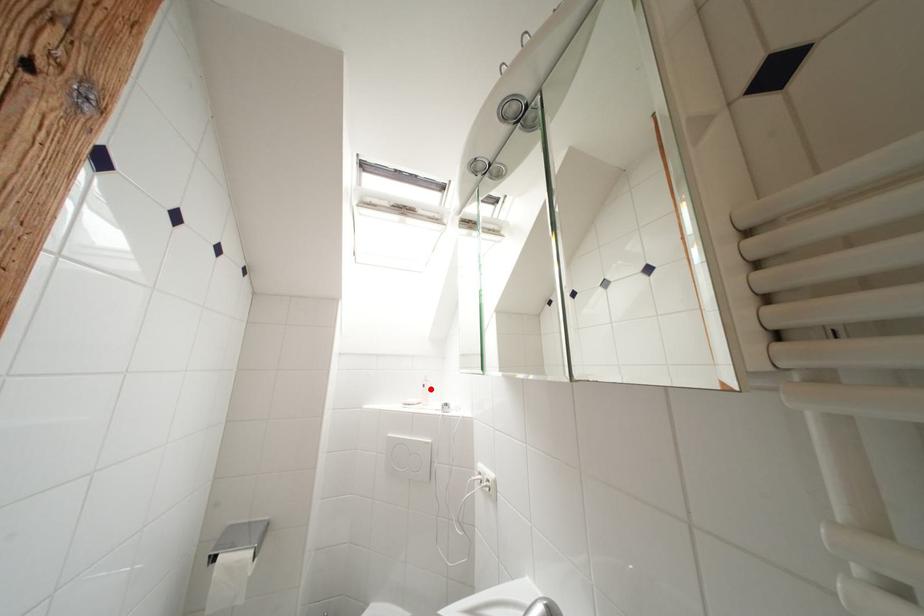
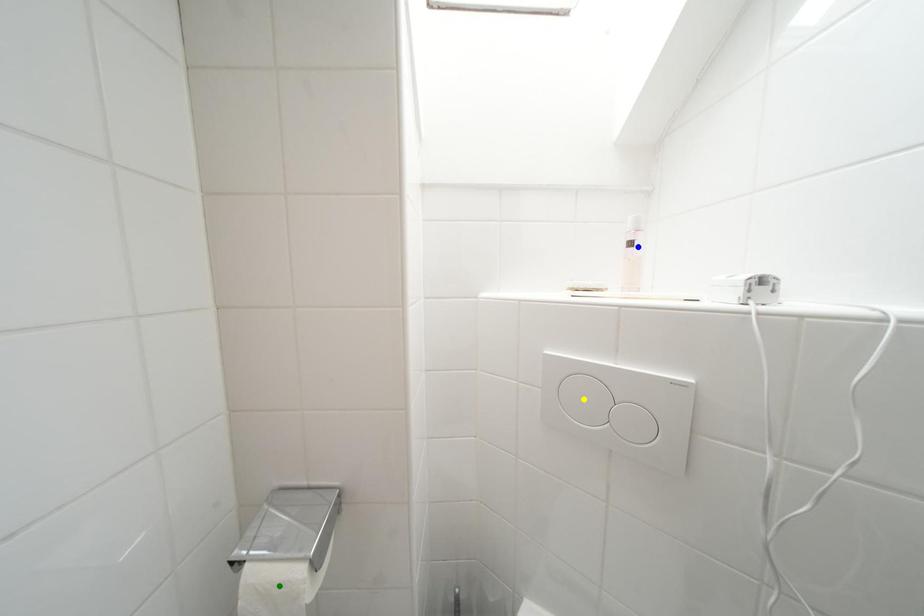
Question: I am providing you with two images of the same scene from different viewpoints. A red point is marked on the first image. You are given multiple points on the second image. Which point in image 2 represents the same 3d spot as the red point in image 1?

Choices:
 (A) green point
 (B) yellow point
 (C) blue point

Answer: (C)